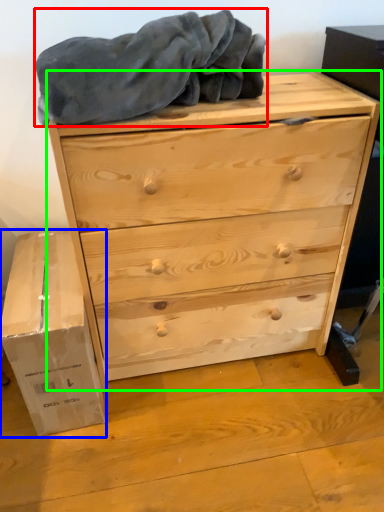
Question: Which is nearer to the blanket (highlighted by a red box)? cardboard box (highlighted by a blue box) or chest of drawers (highlighted by a green box).

Choices:
 (A) cardboard box
 (B) chest of drawers

Answer: (B)